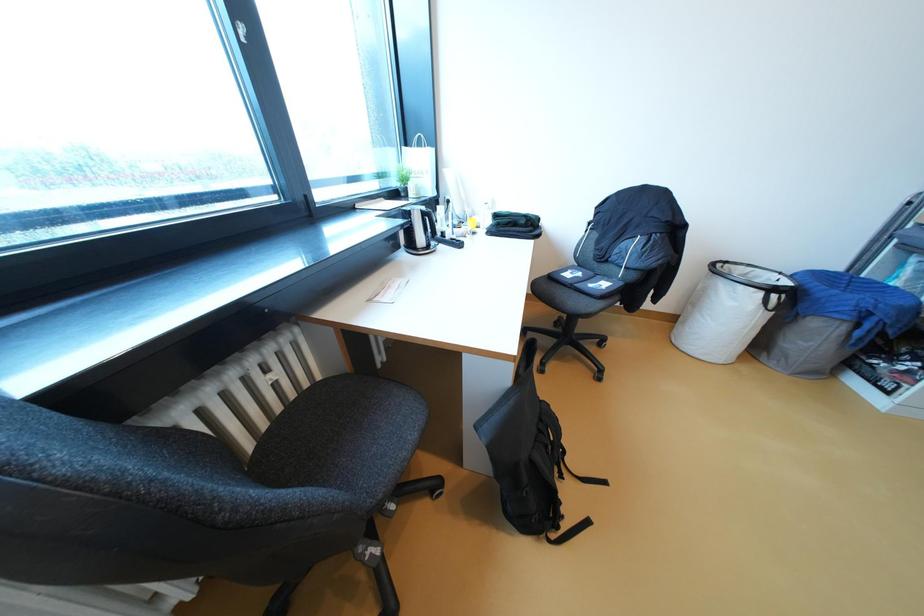
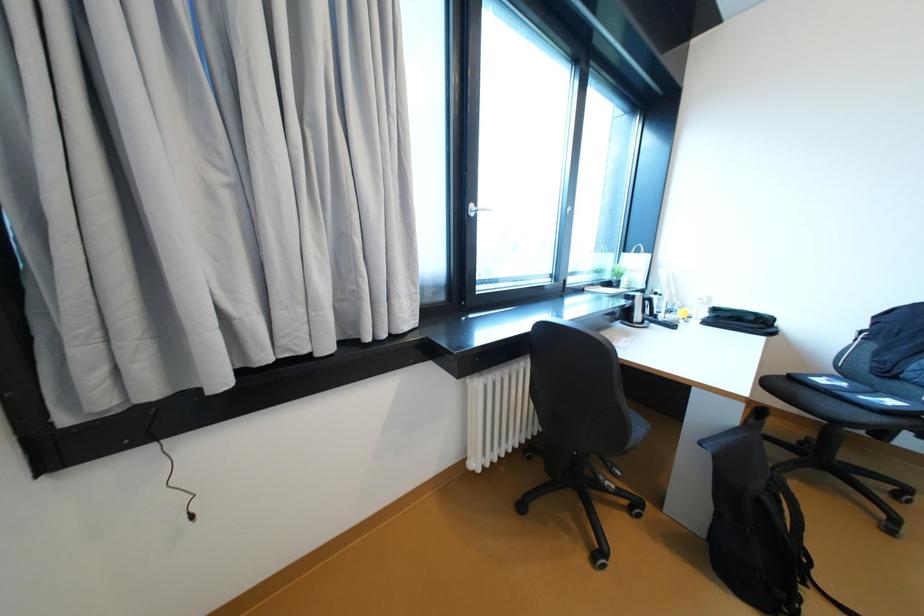
Question: The first image is from the beginning of the video and the second image is from the end. How did the camera likely rotate when shooting the video?

Choices:
 (A) Left
 (B) Right
 (C) Up
 (D) Down

Answer: (A)